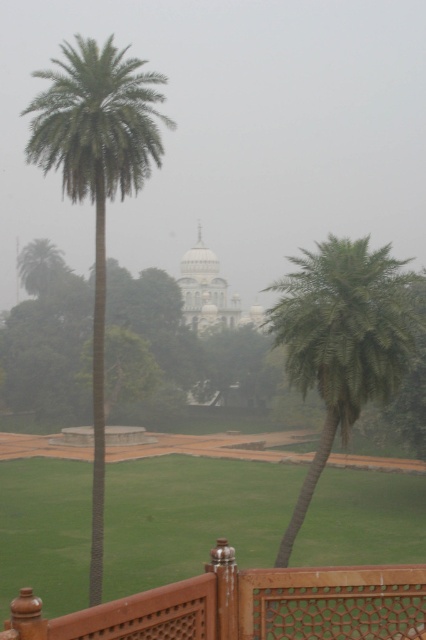
Who is taller, brown wooden fence at lower center or white marble palace at center?

With more height is white marble palace at center.

You are a GUI agent. You are given a task and a screenshot of the screen. Output one action in this format:
    pyautogui.click(x=<x>, y=<y>)
    Task: Click on the brown wooden fence at lower center
    The height and width of the screenshot is (640, 426).
    Given the screenshot: What is the action you would take?
    pyautogui.click(x=247, y=605)

Find the location of a particular element. The height and width of the screenshot is (640, 426). brown wooden fence at lower center is located at coordinates (247, 605).

Is point (279, 618) farther from camera compared to point (367, 342)?

No, it is not.

Is brown wooden fence at lower center closer to the viewer compared to green leafy palm at center?

Yes, brown wooden fence at lower center is closer to the viewer.

I want to click on brown wooden fence at lower center, so click(247, 605).

Where is `brown wooden fence at lower center`? The width and height of the screenshot is (426, 640). brown wooden fence at lower center is located at coordinates click(247, 605).

Does brown wooden fence at lower center have a larger size compared to green leafy palm at left?

Incorrect, brown wooden fence at lower center is not larger than green leafy palm at left.

Is brown wooden fence at lower center above green leafy palm at left?

No.

Locate an element on the screen. This screenshot has height=640, width=426. brown wooden fence at lower center is located at coordinates (247, 605).

Where is `brown wooden fence at lower center`? The height and width of the screenshot is (640, 426). brown wooden fence at lower center is located at coordinates (247, 605).